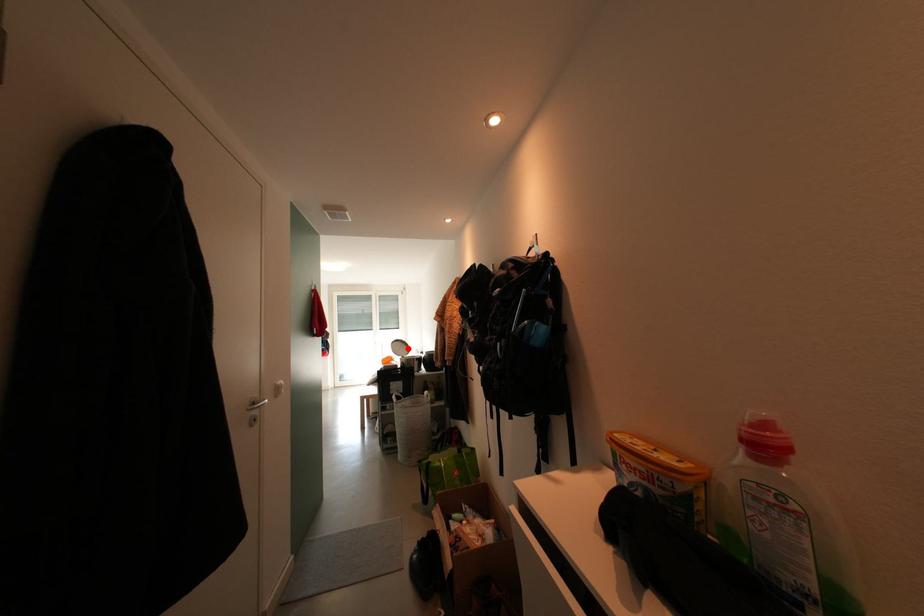
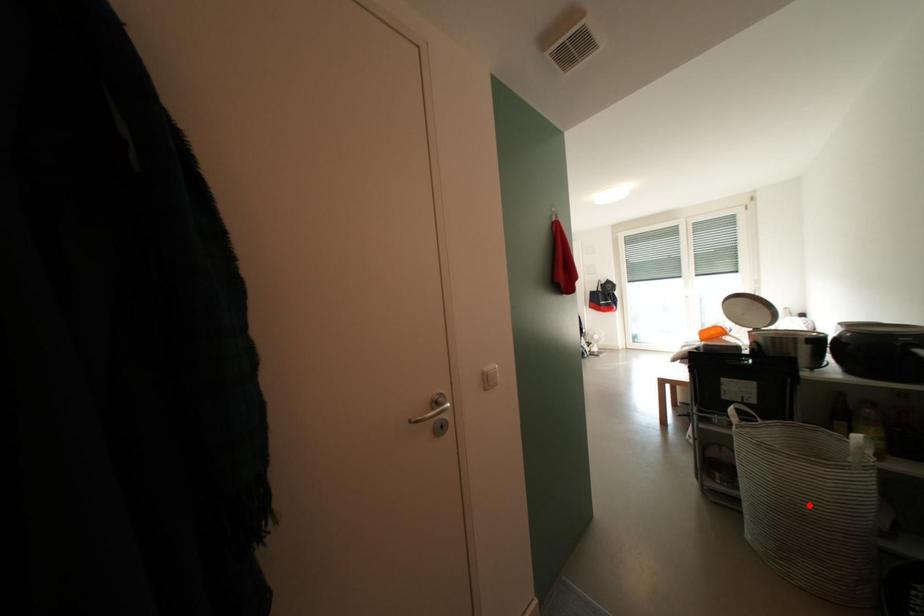
I am providing you with two images of the same scene from different viewpoints. A red point is marked on the first image and another point is marked on the second image. Does the point marked in image1 correspond to the same location as the one in image2?

No